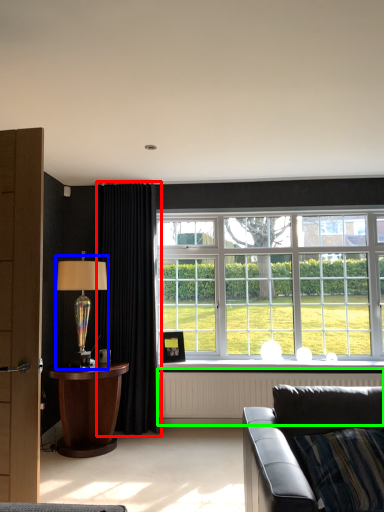
Question: Which object is the farthest from curtain (highlighted by a red box)? Choose among these: table lamp (highlighted by a blue box) or radiator (highlighted by a green box).

Choices:
 (A) table lamp
 (B) radiator

Answer: (B)